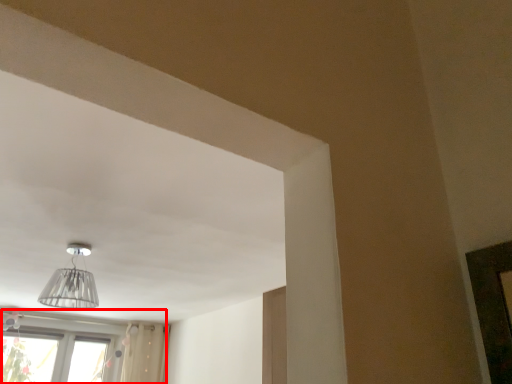
Question: From the image, what is the correct spatial relationship of window (annotated by the red box) in relation to lamp?

Choices:
 (A) right
 (B) left

Answer: (B)